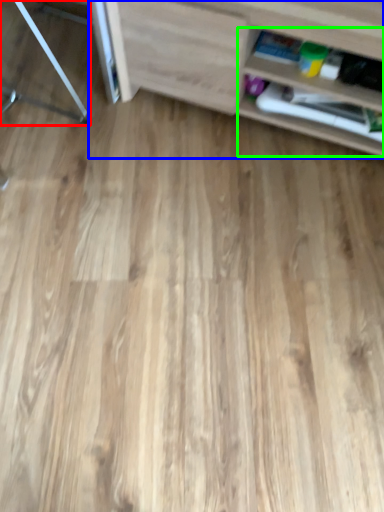
Question: Estimate the real-world distances between objects in this image. Which object is closer to furniture (highlighted by a red box), shelf (highlighted by a blue box) or shelf (highlighted by a green box)?

Choices:
 (A) shelf
 (B) shelf

Answer: (A)